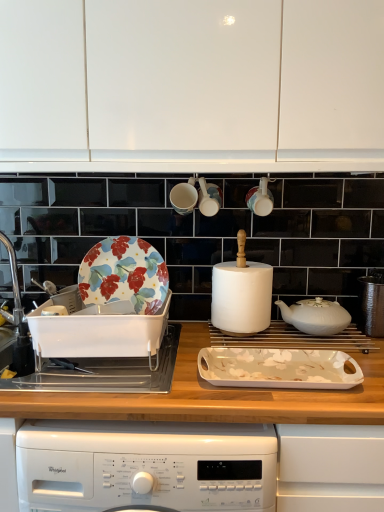
Question: Should I look upward or downward to see white ceramic teapot at center, which is the first kitchen appliance from top to bottom?

Choices:
 (A) up
 (B) down

Answer: (B)

Question: Is floral-patterned ceramic plate at left not near wooden at center?

Choices:
 (A) no
 (B) yes

Answer: (A)

Question: From a real-world perspective, does floral-patterned ceramic plate at left sit lower than wooden at center?

Choices:
 (A) no
 (B) yes

Answer: (A)

Question: Can you confirm if floral-patterned ceramic plate at left is taller than wooden at center?

Choices:
 (A) yes
 (B) no

Answer: (B)

Question: From the image's perspective, is floral-patterned ceramic plate at left located above wooden at center?

Choices:
 (A) yes
 (B) no

Answer: (A)

Question: Is floral-patterned ceramic plate at left thinner than wooden at center?

Choices:
 (A) no
 (B) yes

Answer: (B)

Question: Would you say floral-patterned ceramic plate at left contains wooden at center?

Choices:
 (A) no
 (B) yes

Answer: (A)

Question: Considering the relative sizes of white glossy tray at center, which ranks as the first kitchen appliance in front-to-back order, and white ceramic teapot at center, the 2th kitchen appliance in the bottom-to-top sequence, in the image provided, is white glossy tray at center, which ranks as the first kitchen appliance in front-to-back order, taller than white ceramic teapot at center, the 2th kitchen appliance in the bottom-to-top sequence,?

Choices:
 (A) yes
 (B) no

Answer: (B)

Question: Does white glossy tray at center, which is counted as the first kitchen appliance, starting from the bottom, come in front of white ceramic teapot at center, which is the first kitchen appliance from top to bottom?

Choices:
 (A) no
 (B) yes

Answer: (B)

Question: Considering the relative positions of white glossy tray at center, which ranks as the first kitchen appliance in front-to-back order, and white ceramic teapot at center, which is counted as the first kitchen appliance, starting from the back, in the image provided, is white glossy tray at center, which ranks as the first kitchen appliance in front-to-back order, to the left of white ceramic teapot at center, which is counted as the first kitchen appliance, starting from the back, from the viewer's perspective?

Choices:
 (A) no
 (B) yes

Answer: (B)

Question: Can you confirm if white glossy tray at center, acting as the 2th kitchen appliance starting from the back, is smaller than white ceramic teapot at center, the 2th kitchen appliance in the bottom-to-top sequence?

Choices:
 (A) no
 (B) yes

Answer: (B)

Question: Is white glossy tray at center, which is the 2th kitchen appliance in top-to-bottom order, facing towards white ceramic teapot at center, which is counted as the first kitchen appliance, starting from the back?

Choices:
 (A) no
 (B) yes

Answer: (A)

Question: Is white glossy tray at center, which is the 2th kitchen appliance in top-to-bottom order, bigger than white ceramic teapot at center, which is the first kitchen appliance from top to bottom?

Choices:
 (A) yes
 (B) no

Answer: (B)

Question: From the image's perspective, is white matte cabinet at upper center located above silver metallic sink at left, which is counted as the 1th sink, starting from the left?

Choices:
 (A) yes
 (B) no

Answer: (A)